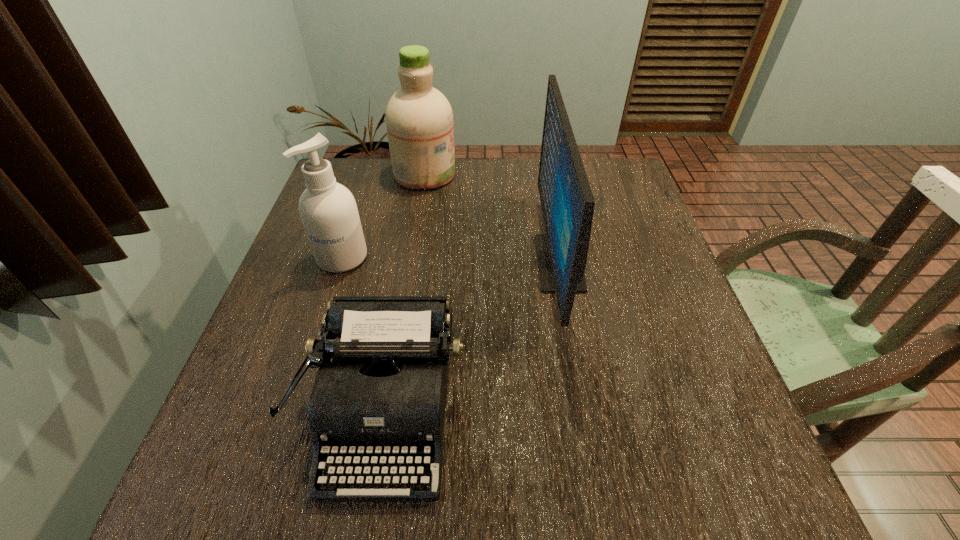
Image resolution: width=960 pixels, height=540 pixels. What are the coordinates of `free spot located 0.050m on the front label of the left cleansing agent` in the screenshot? It's located at (331, 291).

Where is `cleansing agent that is at the far edge`? This screenshot has width=960, height=540. cleansing agent that is at the far edge is located at coordinates (419, 119).

The width and height of the screenshot is (960, 540). What are the coordinates of `computer monitor at the far edge` in the screenshot? It's located at (567, 202).

You are a GUI agent. You are given a task and a screenshot of the screen. Output one action in this format:
    pyautogui.click(x=<x>, y=<y>)
    Task: Click on the object that is at the near edge
    Image resolution: width=960 pixels, height=540 pixels.
    Given the screenshot: What is the action you would take?
    384,392

Find the location of a particular element. cleansing agent situated at the left edge is located at coordinates (328, 211).

Locate an element on the screen. typewriter positioned at the left edge is located at coordinates (384, 392).

Where is `object at the near left corner`? The image size is (960, 540). object at the near left corner is located at coordinates (384, 392).

You are a GUI agent. You are given a task and a screenshot of the screen. Output one action in this format:
    pyautogui.click(x=<x>, y=<y>)
    Task: Click on the free space at the far edge
    
    Given the screenshot: What is the action you would take?
    pyautogui.click(x=516, y=170)

Where is `free space at the near edge of the desktop`? free space at the near edge of the desktop is located at coordinates (466, 468).

Identify the location of vacant space at the left edge of the desktop. (280, 308).